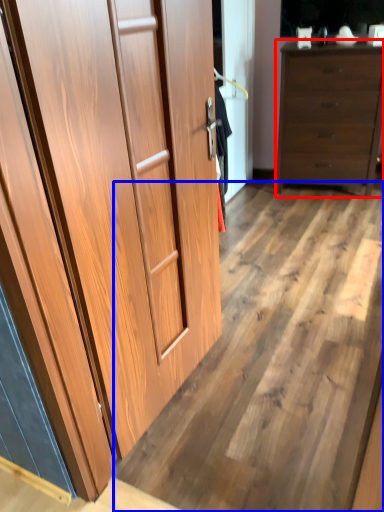
Question: Which object is further to the camera taking this photo, chest of drawers (highlighted by a red box) or plywood (highlighted by a blue box)?

Choices:
 (A) chest of drawers
 (B) plywood

Answer: (A)